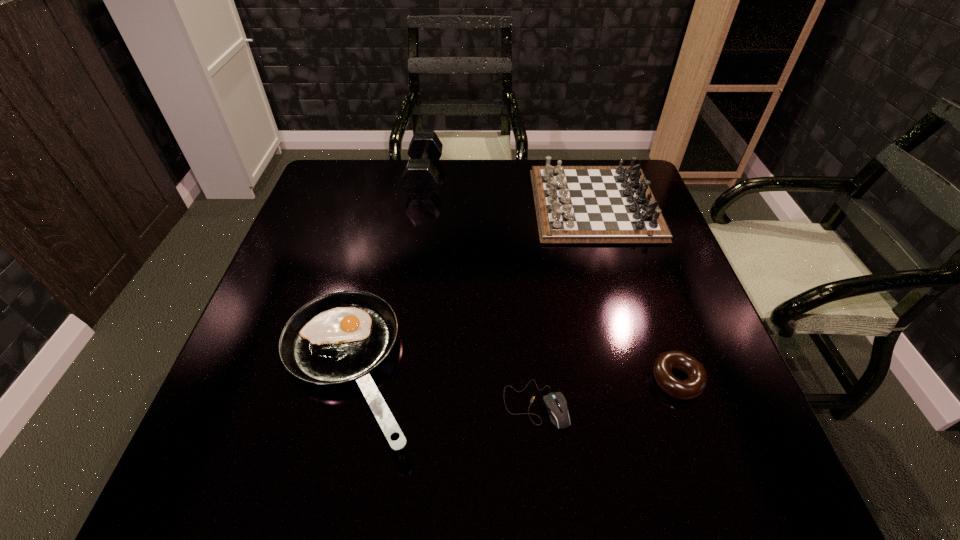
You are a GUI agent. You are given a task and a screenshot of the screen. Output one action in this format:
    pyautogui.click(x=<x>, y=<y>)
    Task: Click on the vacant area situated 0.120m on the left of the doughnut
    
    Given the screenshot: What is the action you would take?
    pyautogui.click(x=590, y=380)

This screenshot has height=540, width=960. I want to click on blank space located on the back of the shortest object, so click(x=530, y=338).

Locate an element on the screen. This screenshot has height=540, width=960. dumbbell located at the far edge is located at coordinates (420, 179).

Identify the location of chessboard located at the far edge. The image size is (960, 540). (574, 204).

At what (x,y) coordinates should I click in order to perform the action: click on object located in the near edge section of the desktop. Please return your answer as a coordinate pair (x, y). This screenshot has height=540, width=960. Looking at the image, I should click on (340, 336).

The image size is (960, 540). Find the location of `object that is at the left edge`. object that is at the left edge is located at coordinates (340, 336).

Image resolution: width=960 pixels, height=540 pixels. What are the coordinates of `chessboard located in the right edge section of the desktop` in the screenshot? It's located at (574, 204).

Find the location of a particular element. The image size is (960, 540). doughnut located in the right edge section of the desktop is located at coordinates (692, 387).

The image size is (960, 540). What are the coordinates of `object located at the near left corner` in the screenshot? It's located at (340, 336).

At what (x,y) coordinates should I click in order to perform the action: click on object located in the far right corner section of the desktop. Please return your answer as a coordinate pair (x, y). Looking at the image, I should click on (574, 204).